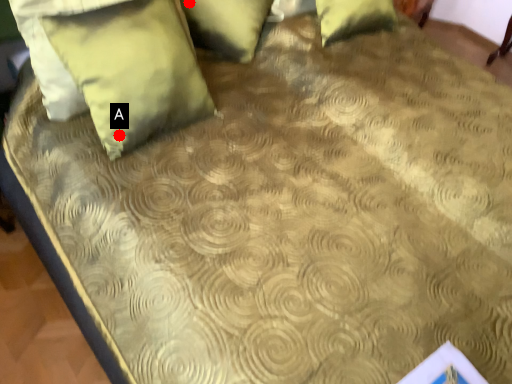
Question: Two points are circled on the image, labeled by A and B beside each circle. Which point is further to the camera?

Choices:
 (A) A is further
 (B) B is further

Answer: (B)